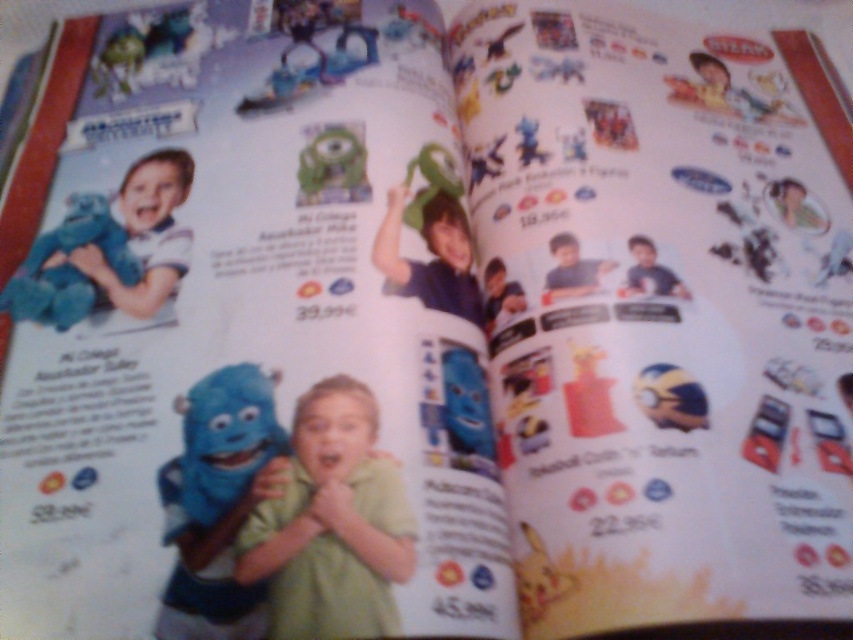
Can you confirm if green matte plush toy at center is positioned below blue plush toy at left?

Indeed, green matte plush toy at center is positioned under blue plush toy at left.

Locate an element on the screen. green matte plush toy at center is located at coordinates (332, 524).

From the picture: Who is more distant from viewer, (316, 552) or (84, 307)?

The point (84, 307) is more distant.

Locate an element on the screen. green matte plush toy at center is located at coordinates (332, 524).

Is matte blue plush at center positioned at the back of blue plush toy at left?

That is False.

In the scene shown: Can you confirm if matte blue plush at center is smaller than blue plush toy at left?

No.

This screenshot has height=640, width=853. In order to click on matte blue plush at center in this screenshot , I will do `click(218, 502)`.

Who is more forward, (309,497) or (171,586)?

Point (171,586)

Can you confirm if green matte plush toy at center is taller than matte blue plush at center?

No, green matte plush toy at center is not taller than matte blue plush at center.

Is point (361, 532) behind point (177, 506)?

No, it is not.

Identify the location of green matte plush toy at center. The width and height of the screenshot is (853, 640). (332, 524).